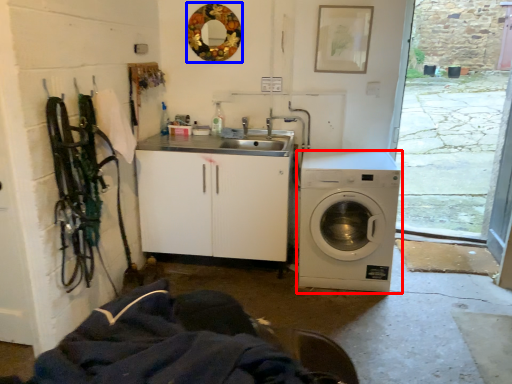
Question: Which point is closer to the camera, washing machine (highlighted by a red box) or mirror (highlighted by a blue box)?

Choices:
 (A) washing machine
 (B) mirror

Answer: (A)